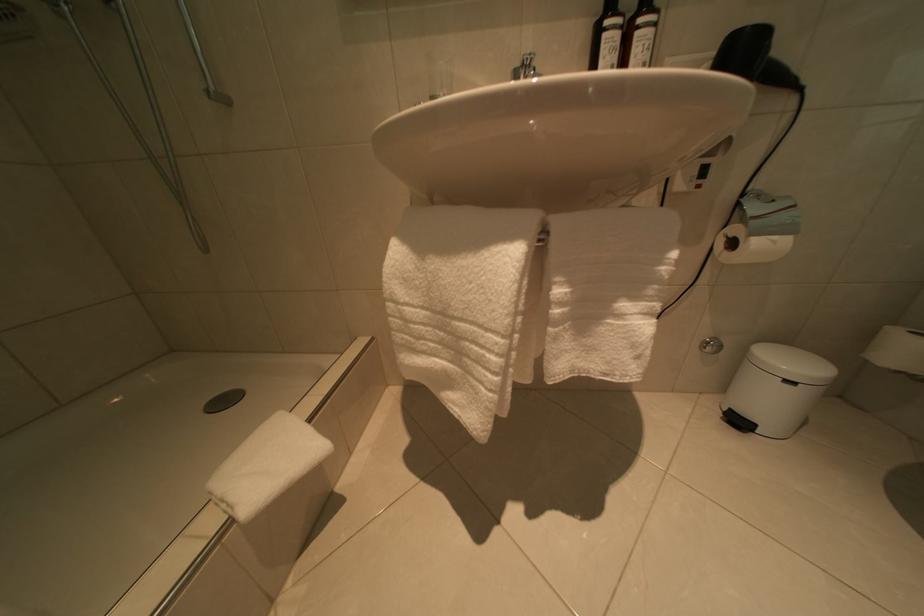
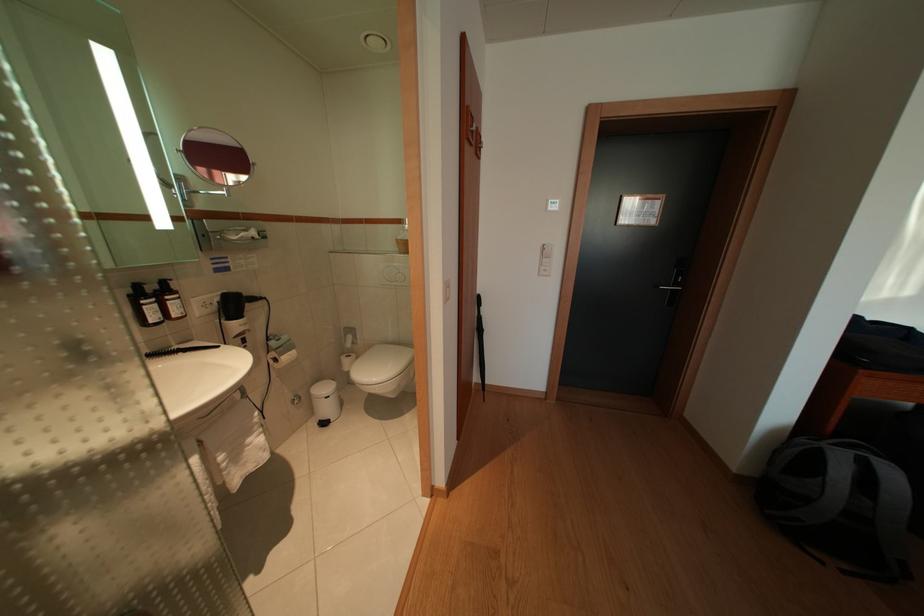
Where in the second image is the point corresponding to point (619, 49) from the first image?

(159, 315)